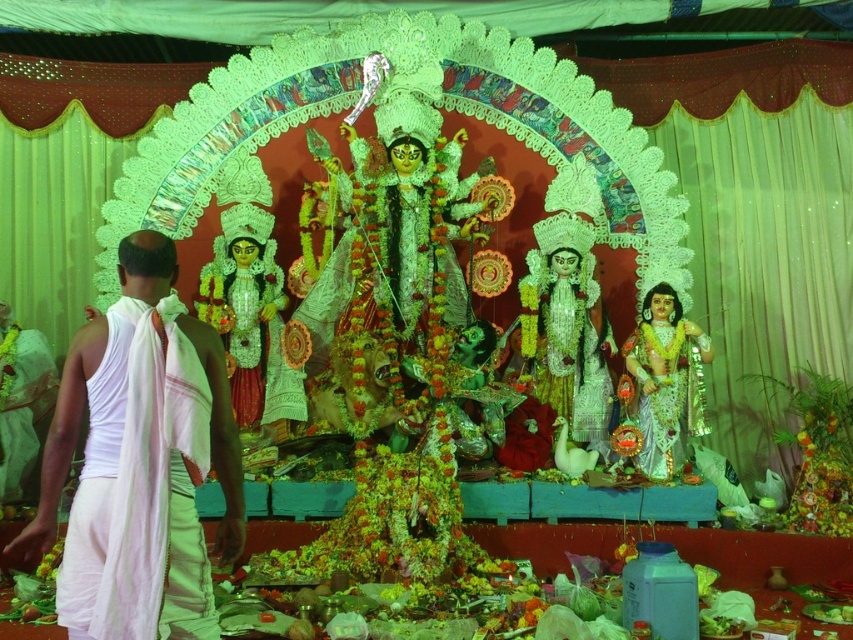
Measure the distance between white clothed person at left and shiny silver statue at center.

white clothed person at left is 22.60 meters away from shiny silver statue at center.

Which is behind, point (114, 476) or point (688, 381)?

Positioned behind is point (688, 381).

The width and height of the screenshot is (853, 640). What do you see at coordinates (85, 465) in the screenshot?
I see `white clothed person at left` at bounding box center [85, 465].

Identify the location of white clothed person at left. The height and width of the screenshot is (640, 853). (85, 465).